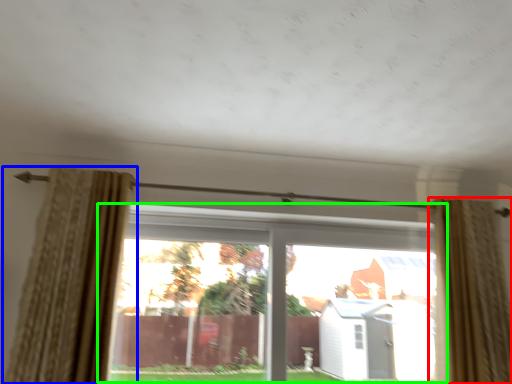
Question: Which object is the farthest from curtain (highlighted by a red box)? Choose among these: curtain (highlighted by a blue box) or window (highlighted by a green box).

Choices:
 (A) curtain
 (B) window

Answer: (A)